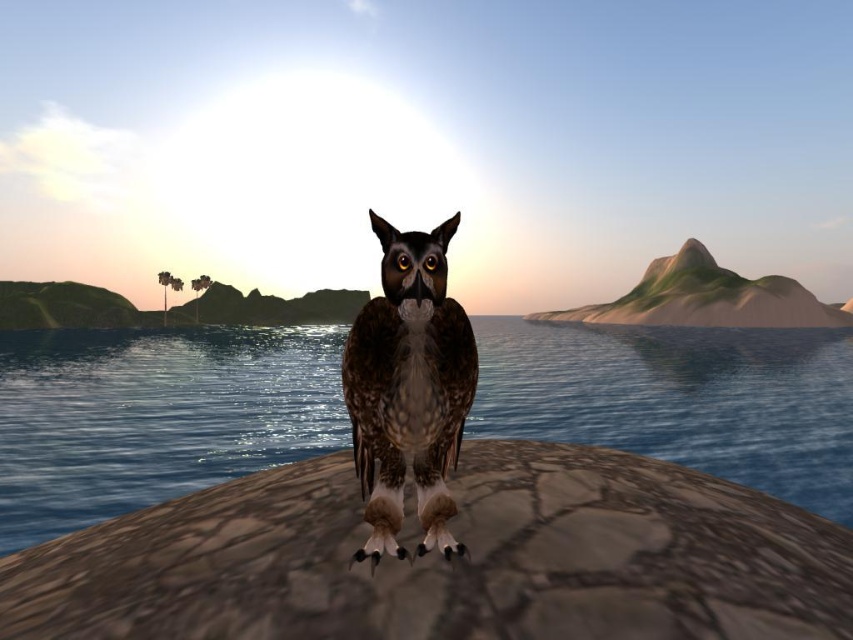
Does blue water at center have a smaller size compared to brown speckled feathers at center?

No, blue water at center is not smaller than brown speckled feathers at center.

Can you confirm if blue water at center is wider than brown speckled feathers at center?

Yes.

You are a GUI agent. You are given a task and a screenshot of the screen. Output one action in this format:
    pyautogui.click(x=<x>, y=<y>)
    Task: Click on the blue water at center
    The width and height of the screenshot is (853, 640).
    Given the screenshot: What is the action you would take?
    pyautogui.click(x=154, y=417)

Identify the location of blue water at center. (x=154, y=417).

Does brown rough stone at center appear over brown speckled feathers at center?

No, brown rough stone at center is not above brown speckled feathers at center.

What do you see at coordinates (448, 563) in the screenshot?
I see `brown rough stone at center` at bounding box center [448, 563].

The image size is (853, 640). What do you see at coordinates (448, 563) in the screenshot? I see `brown rough stone at center` at bounding box center [448, 563].

The height and width of the screenshot is (640, 853). In order to click on brown rough stone at center in this screenshot , I will do `click(448, 563)`.

Is brown rough stone at center wider than blue water at center?

Incorrect, brown rough stone at center's width does not surpass blue water at center's.

Does point (538, 628) come farther from viewer compared to point (329, 442)?

No, it is not.

The image size is (853, 640). What are the coordinates of `brown rough stone at center` in the screenshot? It's located at (448, 563).